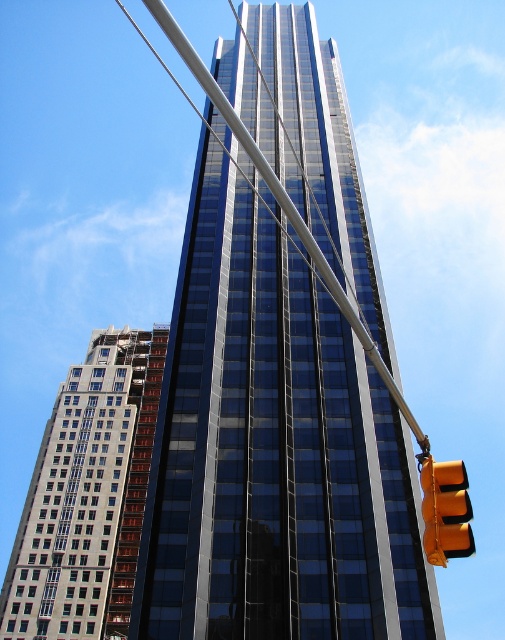
You are a city planner assessing the urban layout. You need to determine if the gray concrete building at left can be seen from the yellow matte traffic light at lower right. Based on their positions and sizes, what is your conclusion?

The gray concrete building at left has a larger width than the yellow matte traffic light at lower right. Since the building is positioned to the left and behind the main skyscraper, its greater width might block the view from the traffic light. However, the exact visibility depends on the distance between them and the height of the traffic light, which aren

You are standing on the sidewalk and see the glossy glass skyscraper at center and the yellow matte traffic light at lower right. Which object is closer to your right side?

The yellow matte traffic light at lower right is closer to your right side because it is positioned to the right of the glossy glass skyscraper at center.

You are standing at a viewpoint 50 feet away from the glossy glass skyscraper at center. Can you safely walk towards it without any obstacles? Please explain your reasoning based on the scene description.

The glossy glass skyscraper at center is only 35.87 feet away from the camera, but you mentioned being 50 feet away. This discrepancy suggests either an error in measurement or that you are not at the stated viewpoint. Assuming the provided distance is accurate, walking towards the skyscraper from 35.87 feet would mean you are already closer than the 50 feet you claimed. There are no mentioned obstacles in the scene description, so if the distance is correct, you could walk towards it freely.